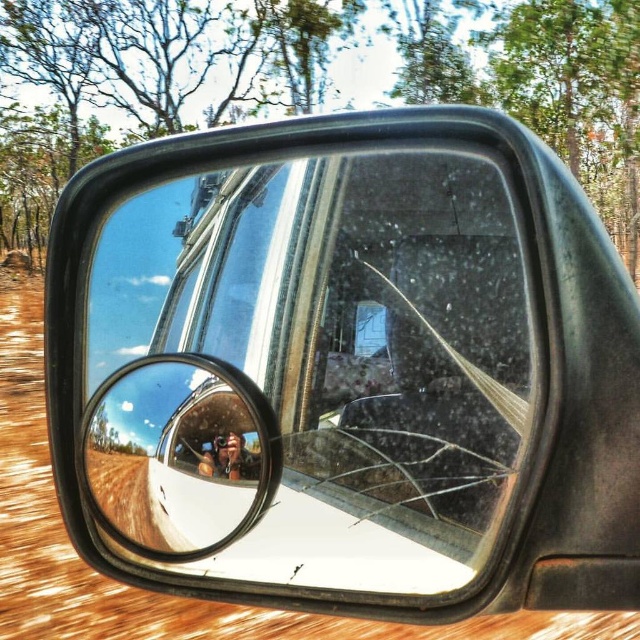
Is clear glass convex mirror at center taller than metallic silver camera at center?

Yes.

Measure the distance between clear glass convex mirror at center and camera.

They are 71.14 centimeters apart.

Find the location of `clear glass convex mirror at center`. clear glass convex mirror at center is located at coordinates (179, 454).